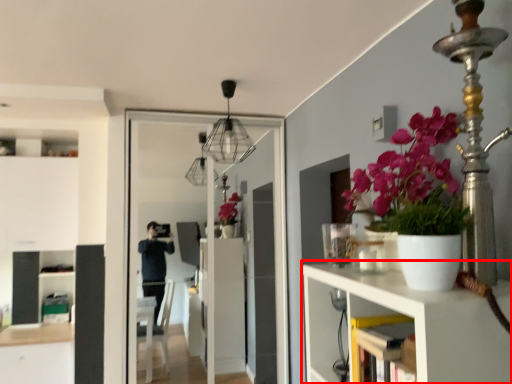
Question: From the image, what is the correct spatial relationship of shelf (annotated by the red box) in relation to screen door?

Choices:
 (A) left
 (B) right

Answer: (B)